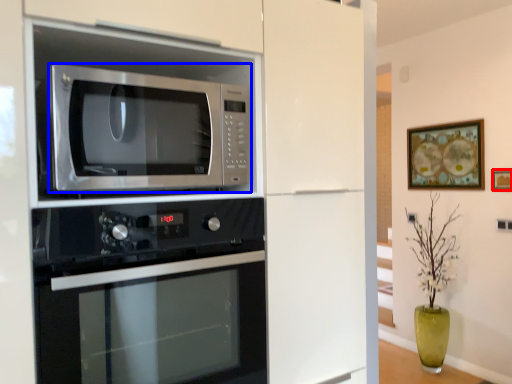
Question: Which of the following is the closest to the observer, picture frame (highlighted by a red box) or microwave oven (highlighted by a blue box)?

Choices:
 (A) picture frame
 (B) microwave oven

Answer: (B)